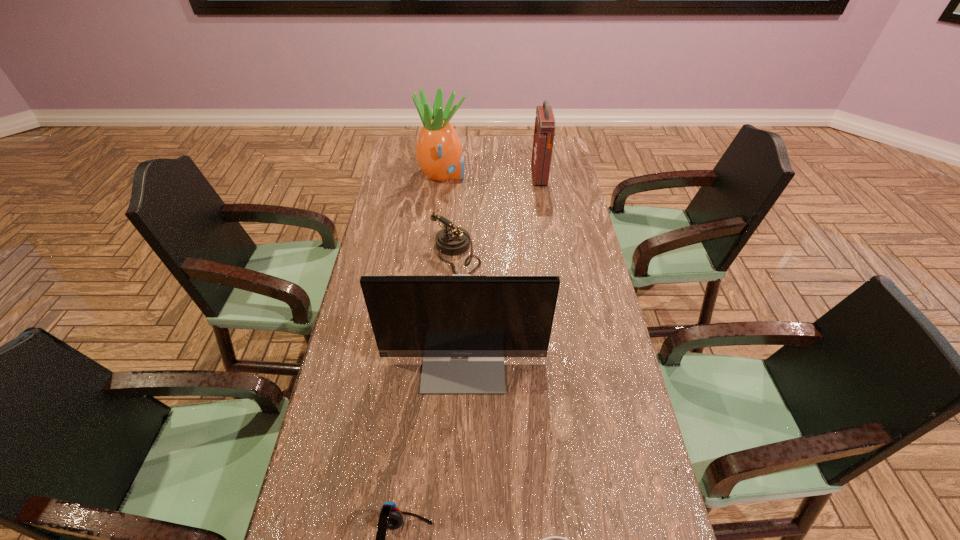
At what (x,y) coordinates should I click in order to perform the action: click on object positioned at the far edge. Please return your answer as a coordinate pair (x, y). This screenshot has height=540, width=960. Looking at the image, I should click on (439, 154).

Locate an element on the screen. The width and height of the screenshot is (960, 540). pineapple present at the left edge is located at coordinates (439, 154).

Where is `computer monitor present at the left edge`? This screenshot has width=960, height=540. computer monitor present at the left edge is located at coordinates (463, 326).

At what (x,y) coordinates should I click in order to perform the action: click on object that is at the right edge. Please return your answer as a coordinate pair (x, y). This screenshot has width=960, height=540. Looking at the image, I should click on (544, 130).

Find the location of a particular element. object situated at the far left corner is located at coordinates click(x=439, y=154).

Locate an element on the screen. vacant space at the far edge of the desktop is located at coordinates (492, 162).

You are a GUI agent. You are given a task and a screenshot of the screen. Output one action in this format:
    pyautogui.click(x=<x>, y=<y>)
    Task: Click on the free space at the left edge of the desktop
    
    Given the screenshot: What is the action you would take?
    pyautogui.click(x=398, y=188)

In the image, there is a desktop. At what (x,y) coordinates should I click in order to perform the action: click on vacant space at the right edge. Please return your answer as a coordinate pair (x, y). This screenshot has height=540, width=960. Looking at the image, I should click on (566, 183).

Find the location of a particular element. The width and height of the screenshot is (960, 540). free space between the first-aid kit and the fourth nearest object is located at coordinates point(497,216).

In order to click on vacant area between the pineapple and the third farthest object in this screenshot , I will do `click(449, 215)`.